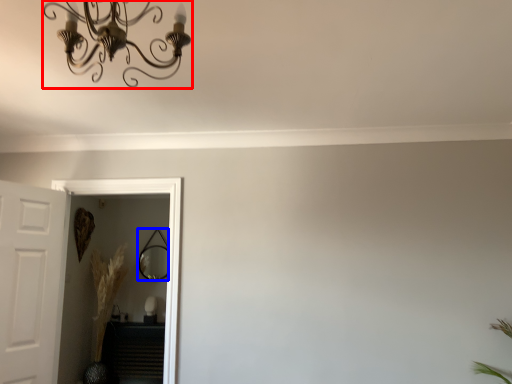
Question: Among these objects, which one is nearest to the camera, light fixture (highlighted by a red box) or mirror (highlighted by a blue box)?

Choices:
 (A) light fixture
 (B) mirror

Answer: (A)